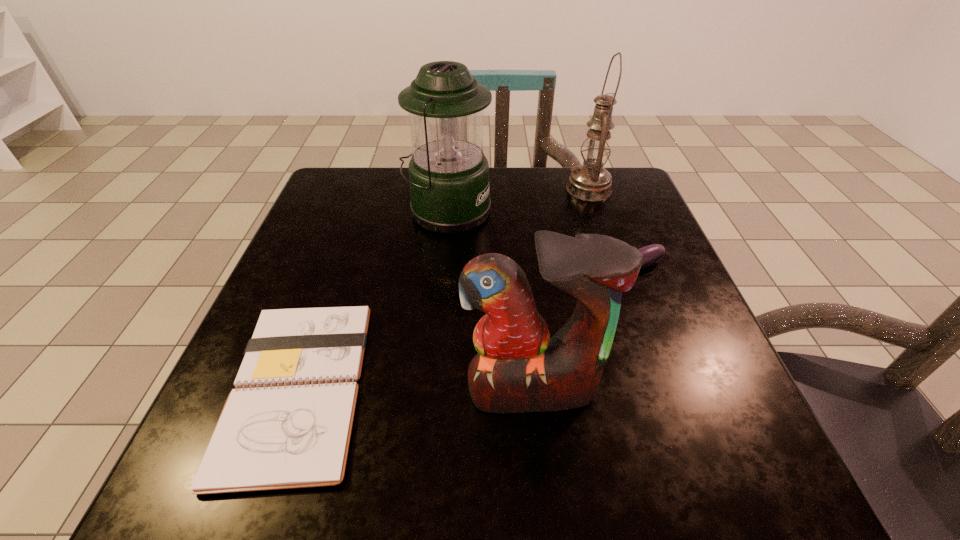
Locate an element on the screen. This screenshot has height=540, width=960. free area in between the notepad and the third shortest object is located at coordinates (415, 388).

This screenshot has height=540, width=960. Identify the location of unoccupied area between the lantern and the notepad. (372, 299).

Image resolution: width=960 pixels, height=540 pixels. Find the location of `object that is the closest to the notepad`. object that is the closest to the notepad is located at coordinates (519, 368).

Where is `object that is the third nearest to the eggplant`? Image resolution: width=960 pixels, height=540 pixels. object that is the third nearest to the eggplant is located at coordinates (591, 181).

Where is `free location that satisfies the following two spatial constraints: 1. on the front side of the fourth tallest object; 2. on the right side of the oil lamp`? Image resolution: width=960 pixels, height=540 pixels. free location that satisfies the following two spatial constraints: 1. on the front side of the fourth tallest object; 2. on the right side of the oil lamp is located at coordinates (616, 271).

The width and height of the screenshot is (960, 540). Find the location of `free space in the image that satisfies the following two spatial constraints: 1. on the back side of the eggplant; 2. on the right side of the notepad`. free space in the image that satisfies the following two spatial constraints: 1. on the back side of the eggplant; 2. on the right side of the notepad is located at coordinates (338, 271).